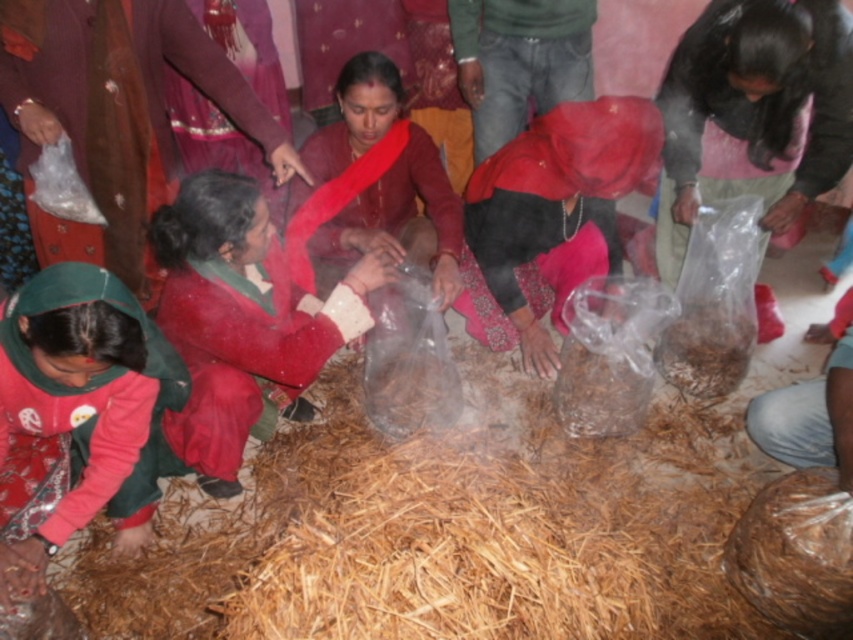
You are a photographer standing in front of the scene. You need to take a clear photo of both the matte red saree at lower left and the green fabric cap at lower left. Which object should you focus on first to ensure both are in focus?

The matte red saree at lower left is closer to you than the green fabric cap at lower left. To ensure both are in focus, focus on the matte red saree at lower left first, as it is closer, and the green fabric cap at lower left will be in the background.

You are a photographer trying to capture a closeup shot of both the matte red saree at lower left and the green fabric cap at lower left. Given that your camera can focus on objects within a 25 inch range, will you be able to capture both in the same frame without moving the camera?

The matte red saree at lower left is 30.43 inches from the green fabric cap at lower left. Since the distance between them exceeds the camera focus range of 25 inches, you will not be able to capture both in the same frame without moving the camera.

You are a photographer trying to capture the scene of the communal activity. You notice the matte red saree at lower left and the green fabric cap at lower left. Which object is more to the left in the image?

The matte red saree at lower left is positioned on the left side of green fabric cap at lower left, so the matte red saree at lower left is more to the left.